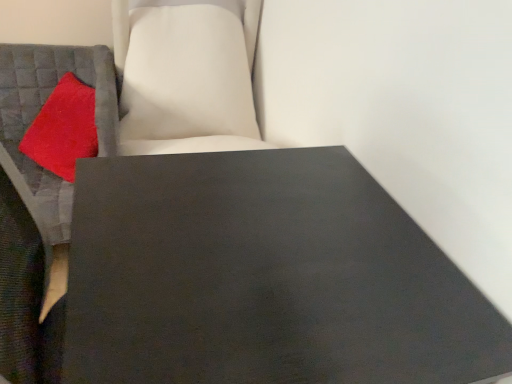
Question: From a real-world perspective, is matte gray cushion at left physically located above or below matte black table at center?

Choices:
 (A) below
 (B) above

Answer: (A)

Question: In terms of width, does matte gray cushion at left look wider or thinner when compared to matte black table at center?

Choices:
 (A) thin
 (B) wide

Answer: (B)

Question: Considering the real-world distances, which object is closest to the matte black table at center?

Choices:
 (A) velvety red pillow at left
 (B) matte gray cushion at left

Answer: (B)

Question: Which of these objects is positioned closest to the velvety red pillow at left?

Choices:
 (A) matte black table at center
 (B) matte gray cushion at left

Answer: (B)